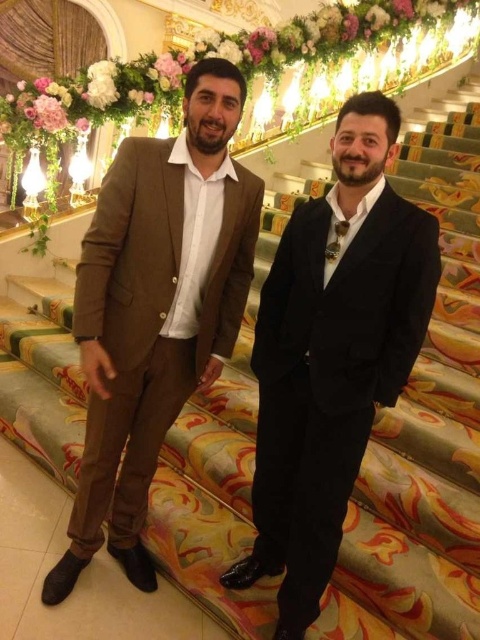
You are a fashion designer observing two suits displayed on mannequins in the center of a grand staircase. The black satin suit at center and the matte brown suit at center are part of a new collection. Which suit takes up less space horizontally?

The black satin suit at center has a lesser width compared to the matte brown suit at center, so it takes up less horizontal space.